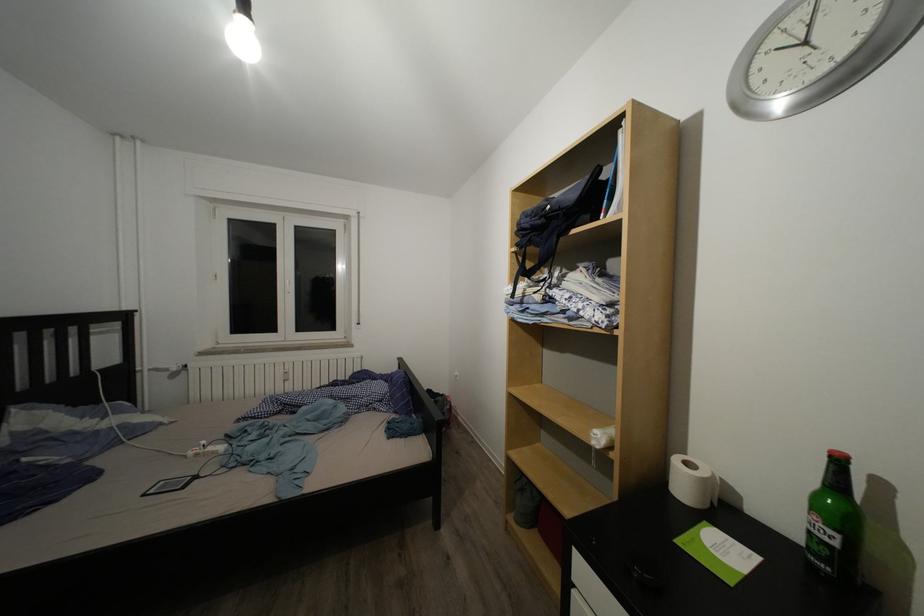
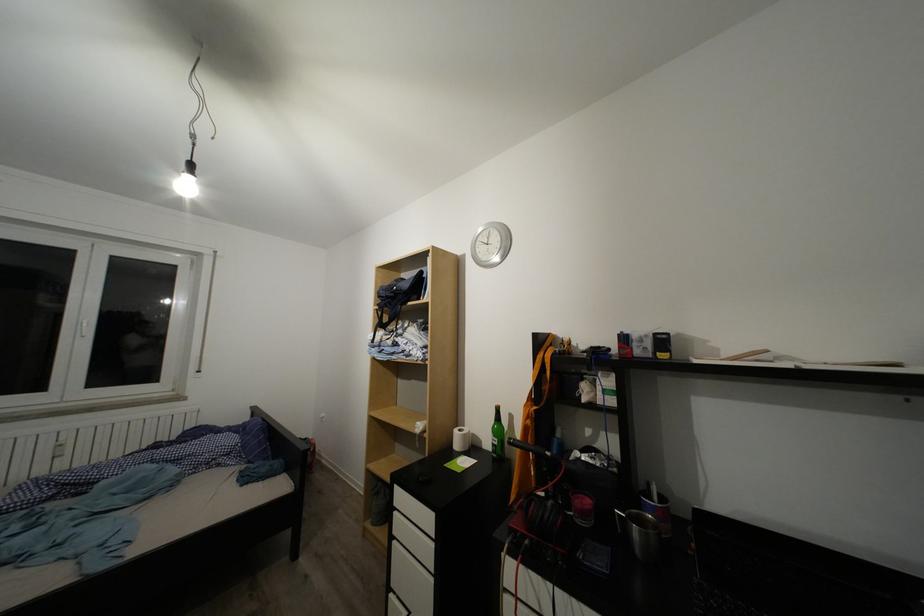
Question: The images are taken continuously from a first-person perspective. In which direction are you moving?

Choices:
 (A) Left
 (B) Right
 (C) Forward
 (D) Backward

Answer: (D)